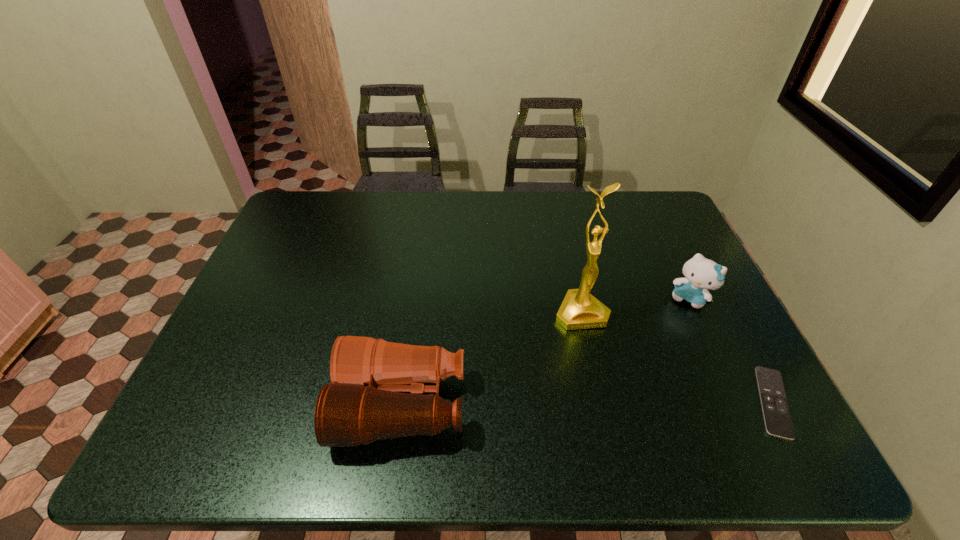
Locate an element on the screen. The image size is (960, 540). free location located 0.230m on the front-facing side of the third object from right to left is located at coordinates (624, 409).

Find the location of `vacant area situated 0.110m on the front-facing side of the third object from right to left`. vacant area situated 0.110m on the front-facing side of the third object from right to left is located at coordinates (605, 365).

The height and width of the screenshot is (540, 960). I want to click on vacant region located on the face of the kitten, so click(622, 412).

In order to click on vacant space located 0.360m on the face of the kitten in this screenshot , I will do `click(628, 403)`.

This screenshot has height=540, width=960. What are the coordinates of `free space located on the face of the kitten` in the screenshot? It's located at (630, 400).

I want to click on binoculars positioned at the near edge, so click(x=364, y=403).

Locate an element on the screen. The image size is (960, 540). remote control at the near edge is located at coordinates (777, 419).

Where is `remote control at the right edge`? This screenshot has height=540, width=960. remote control at the right edge is located at coordinates (777, 419).

You are a GUI agent. You are given a task and a screenshot of the screen. Output one action in this format:
    pyautogui.click(x=<x>, y=<y>)
    Task: Click on the kitten situated at the right edge
    
    Given the screenshot: What is the action you would take?
    pyautogui.click(x=701, y=274)

You are a GUI agent. You are given a task and a screenshot of the screen. Output one action in this format:
    pyautogui.click(x=<x>, y=<y>)
    Task: Click on the object present at the near right corner
    
    Given the screenshot: What is the action you would take?
    pyautogui.click(x=777, y=419)